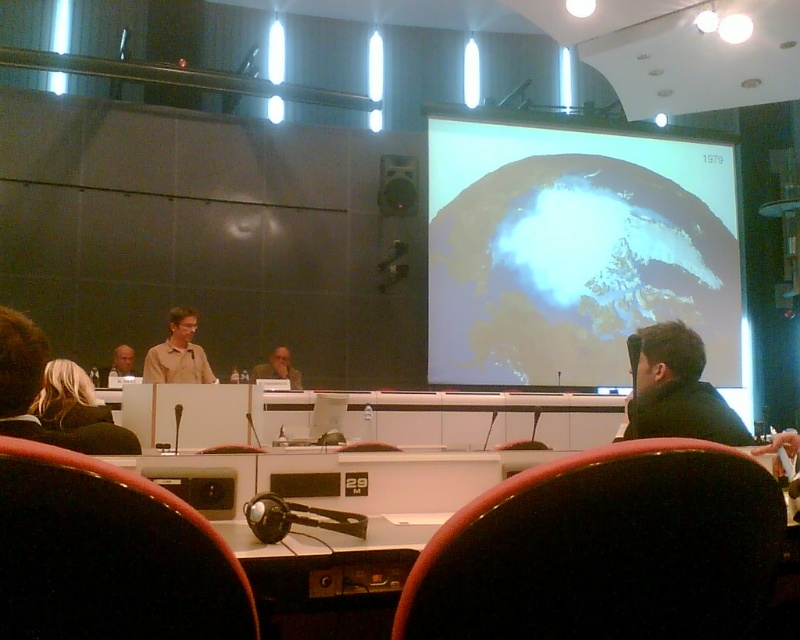
Question: Estimate the real-world distances between objects in this image. Which object is farther from the matte beige shirt at center?

Choices:
 (A) blonde hair at lower left
 (B) white matte projection screen at upper right

Answer: (A)

Question: Can you confirm if white matte projection screen at upper right is positioned to the left of black matte jacket at lower right?

Choices:
 (A) no
 (B) yes

Answer: (A)

Question: Which of these objects is positioned closest to the matte brown shirt at left?

Choices:
 (A) matte beige shirt at center
 (B) white matte projection screen at upper right
 (C) matte black speaker at center

Answer: (A)

Question: Which point is farther to the camera?

Choices:
 (A) blonde hair at lower left
 (B) white matte projection screen at upper right

Answer: (B)

Question: Does matte black speaker at center lie in front of matte beige shirt at center?

Choices:
 (A) yes
 (B) no

Answer: (B)

Question: Is black matte jacket at lower right below matte beige shirt at center?

Choices:
 (A) yes
 (B) no

Answer: (B)